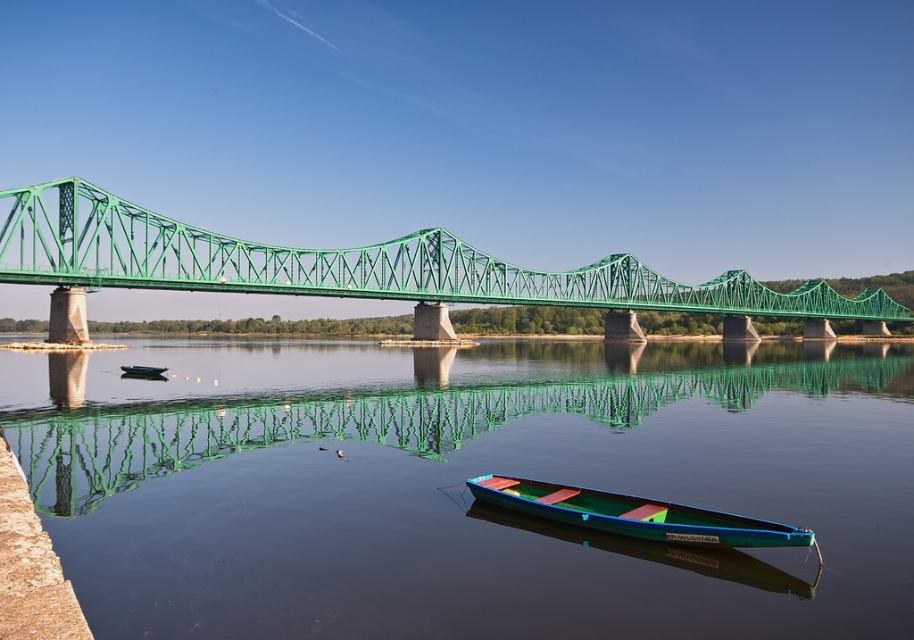
Question: Which is nearer to the smooth water at center?

Choices:
 (A) green metal bridge at center
 (B) green plastic boat at center
 (C) teal glossy canoe at lower center

Answer: (C)

Question: Which of the following is the closest to the observer?

Choices:
 (A) green plastic boat at center
 (B) smooth water at center
 (C) green metal bridge at center
 (D) teal glossy canoe at lower center

Answer: (B)

Question: Is green metal bridge at center to the left of green plastic boat at center from the viewer's perspective?

Choices:
 (A) yes
 (B) no

Answer: (B)

Question: Is teal glossy canoe at lower center to the left of green plastic boat at center from the viewer's perspective?

Choices:
 (A) yes
 (B) no

Answer: (B)

Question: Is the position of green metal bridge at center more distant than that of teal glossy canoe at lower center?

Choices:
 (A) no
 (B) yes

Answer: (B)

Question: Which object is positioned farthest from the smooth water at center?

Choices:
 (A) green metal bridge at center
 (B) teal glossy canoe at lower center

Answer: (A)